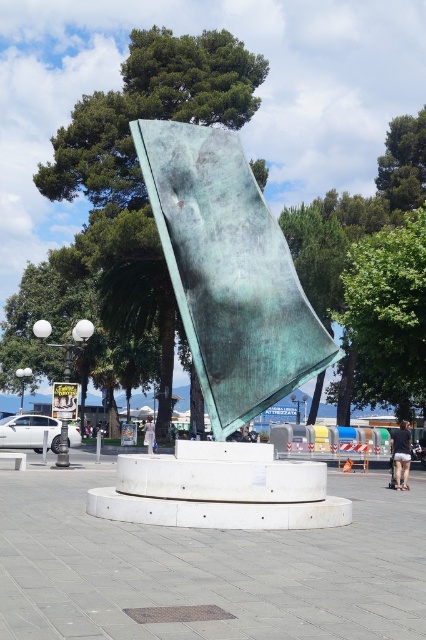
Question: Considering the real-world distances, which object is closest to the white fabric person at center?

Choices:
 (A) green leafy tree at center
 (B) dark gray shorts at lower right

Answer: (A)

Question: Is dark gray shorts at lower right below white fabric person at center?

Choices:
 (A) yes
 (B) no

Answer: (B)

Question: Does green leafy tree at upper center appear on the left side of green leafy tree at center?

Choices:
 (A) no
 (B) yes

Answer: (B)

Question: Based on their relative distances, which object is farther from the green leafy tree at center?

Choices:
 (A) green leafy tree at upper right
 (B) dark gray shorts at lower right
 (C) green leafy tree at upper center

Answer: (C)

Question: Is dark gray shorts at lower right below white fabric person at center?

Choices:
 (A) yes
 (B) no

Answer: (B)

Question: Among these objects, which one is nearest to the camera?

Choices:
 (A) green leafy tree at upper right
 (B) smooth concrete base at center
 (C) green patina metal at center

Answer: (B)